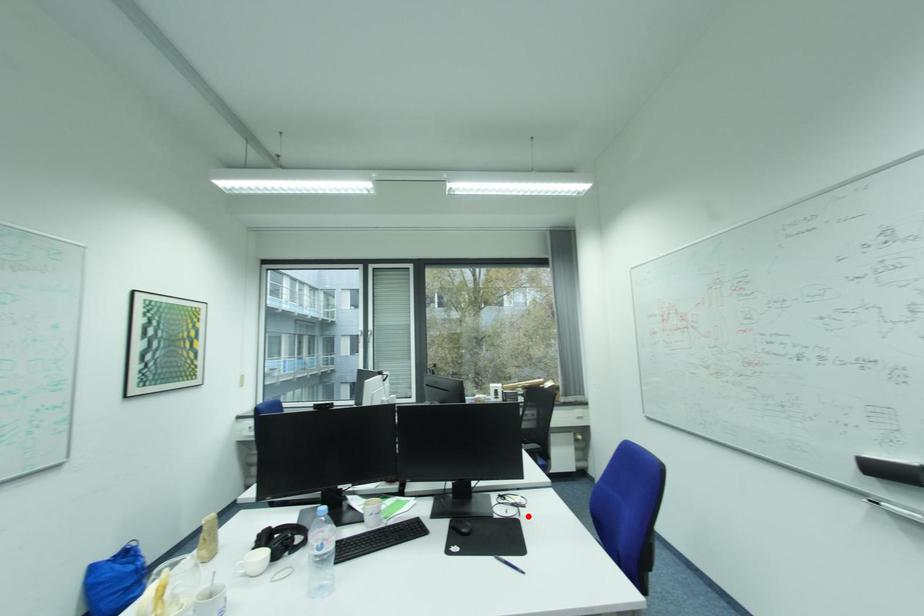
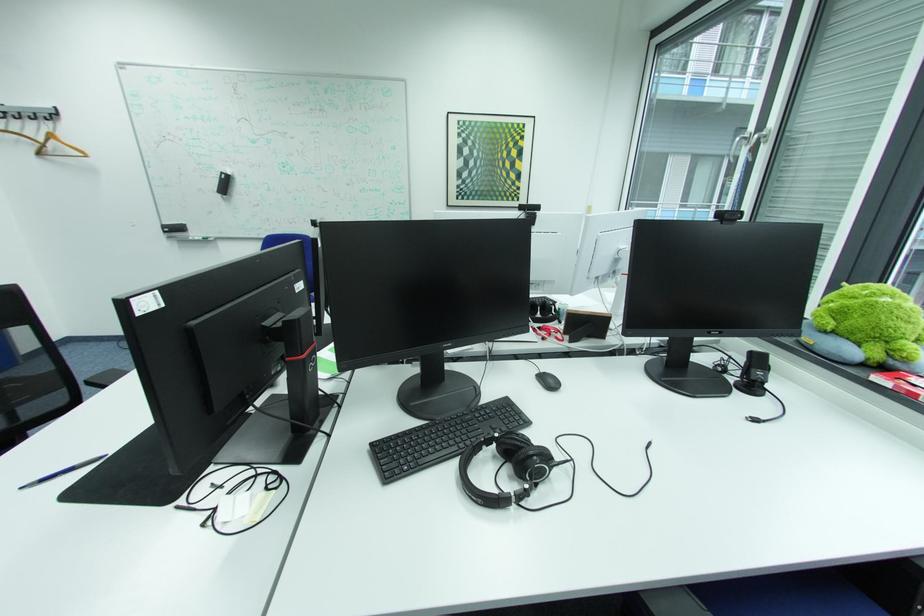
Locate, in the second image, the point that corresponds to the highlighted location in the first image.

(187, 508)